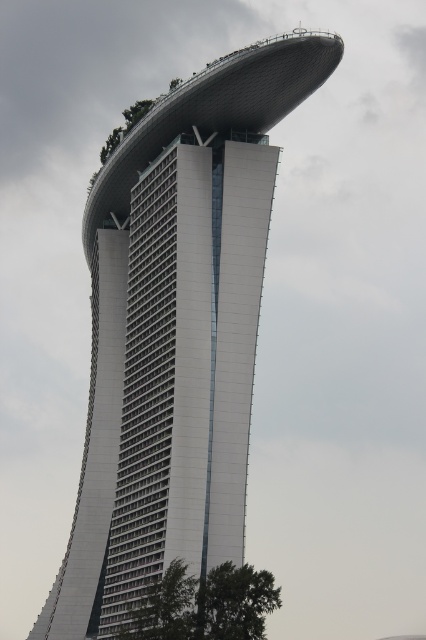
Question: Which point is farther to the camera?

Choices:
 (A) white glass tower at center
 (B) green leafy tree at lower right

Answer: (A)

Question: Which point is closer to the camera taking this photo?

Choices:
 (A) (187, 168)
 (B) (189, 630)

Answer: (B)

Question: Which point is farther from the camera taking this photo?

Choices:
 (A) (268, 608)
 (B) (241, 100)

Answer: (B)

Question: Is white glass tower at center below green leafy tree at lower right?

Choices:
 (A) yes
 (B) no

Answer: (B)

Question: Is white glass tower at center thinner than green leafy tree at lower right?

Choices:
 (A) no
 (B) yes

Answer: (A)

Question: In this image, where is white glass tower at center located relative to green leafy tree at lower right?

Choices:
 (A) above
 (B) below

Answer: (A)